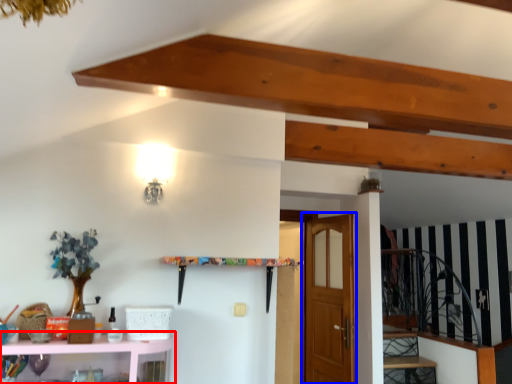
Question: Which object is closer to the camera taking this photo, shelf (highlighted by a red box) or door (highlighted by a blue box)?

Choices:
 (A) shelf
 (B) door

Answer: (A)